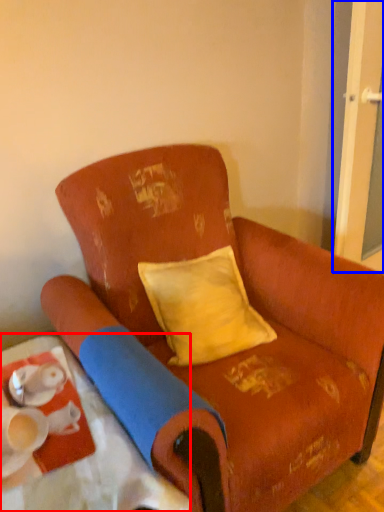
Question: Which object is closer to the camera taking this photo, table (highlighted by a red box) or screen door (highlighted by a blue box)?

Choices:
 (A) table
 (B) screen door

Answer: (A)